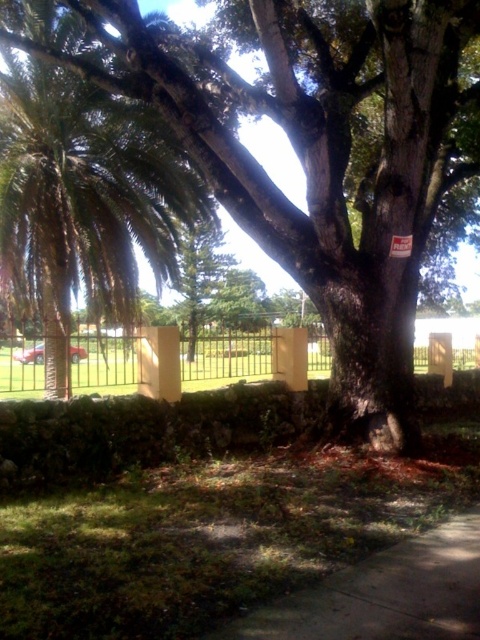
Question: Which of these objects is positioned farthest from the green leafy palm tree at left?

Choices:
 (A) metallic silver fence at center
 (B) green rough bark tree at center

Answer: (B)

Question: Which of the following is the closest to the observer?

Choices:
 (A) (351, 369)
 (B) (180, 179)
 (C) (218, 353)

Answer: (A)

Question: In this image, where is green leafy palm tree at left located relative to metallic silver fence at center?

Choices:
 (A) above
 (B) below

Answer: (A)

Question: Is green rough bark tree at center closer to camera compared to green leafy palm tree at left?

Choices:
 (A) no
 (B) yes

Answer: (B)

Question: Which is nearer to the green rough bark tree at center?

Choices:
 (A) metallic silver fence at center
 (B) green leafy palm tree at left

Answer: (B)

Question: Does green leafy palm tree at left appear over metallic silver fence at center?

Choices:
 (A) yes
 (B) no

Answer: (A)